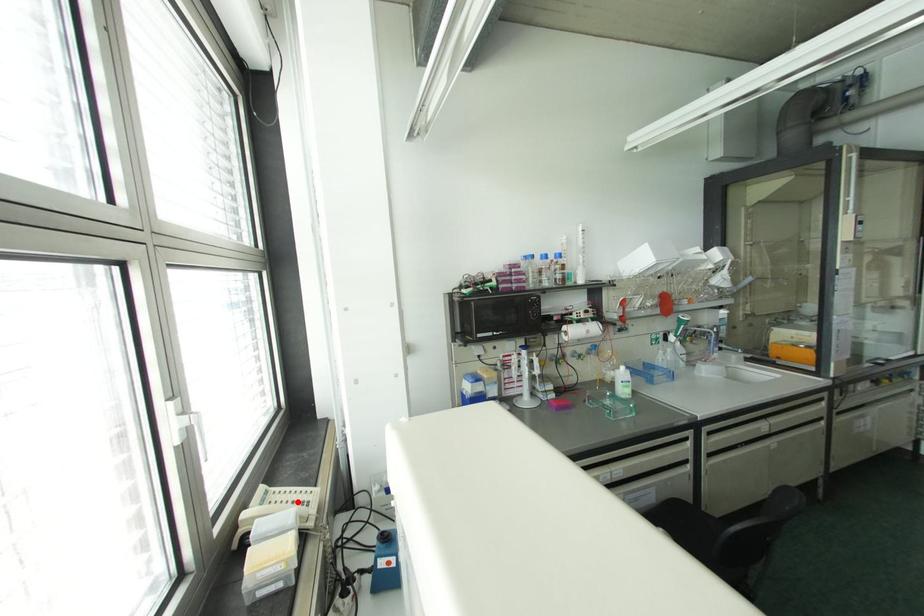
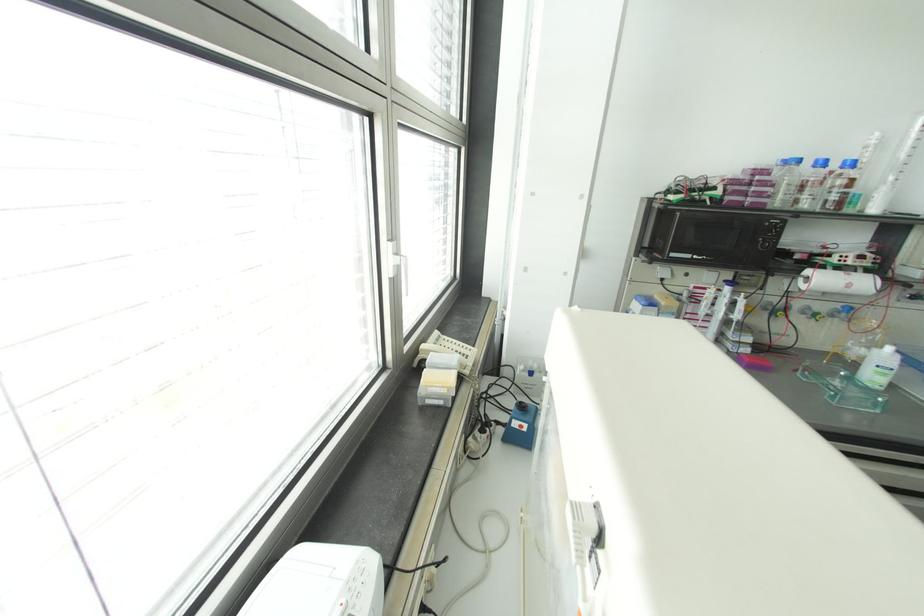
Where in the second image is the point corresponding to the highlighted location from the first image?

(459, 353)